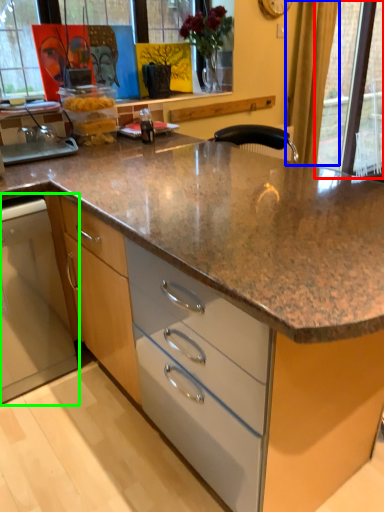
Question: Estimate the real-world distances between objects in this image. Which object is farther from glass door (highlighted by a red box), curtain (highlighted by a blue box) or home appliance (highlighted by a green box)?

Choices:
 (A) curtain
 (B) home appliance

Answer: (B)